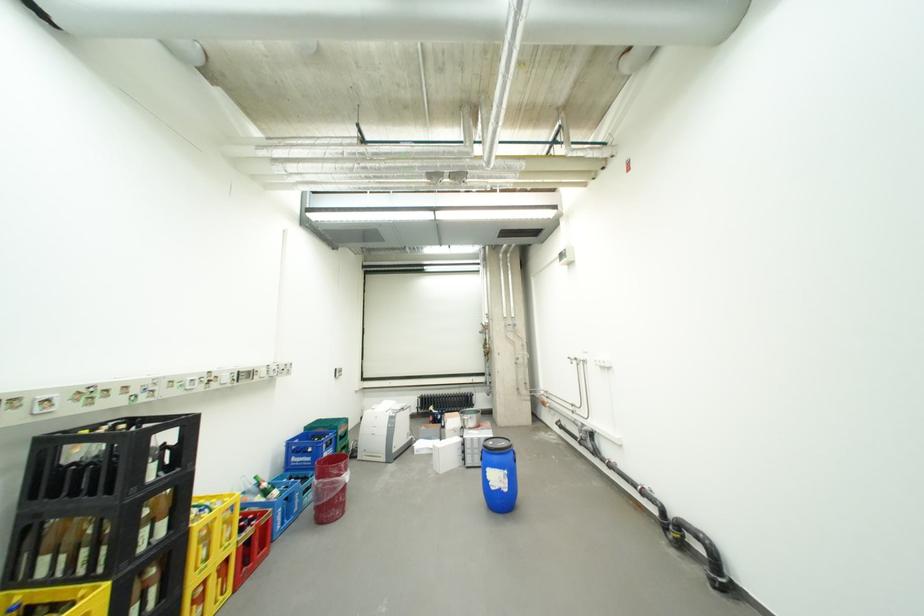
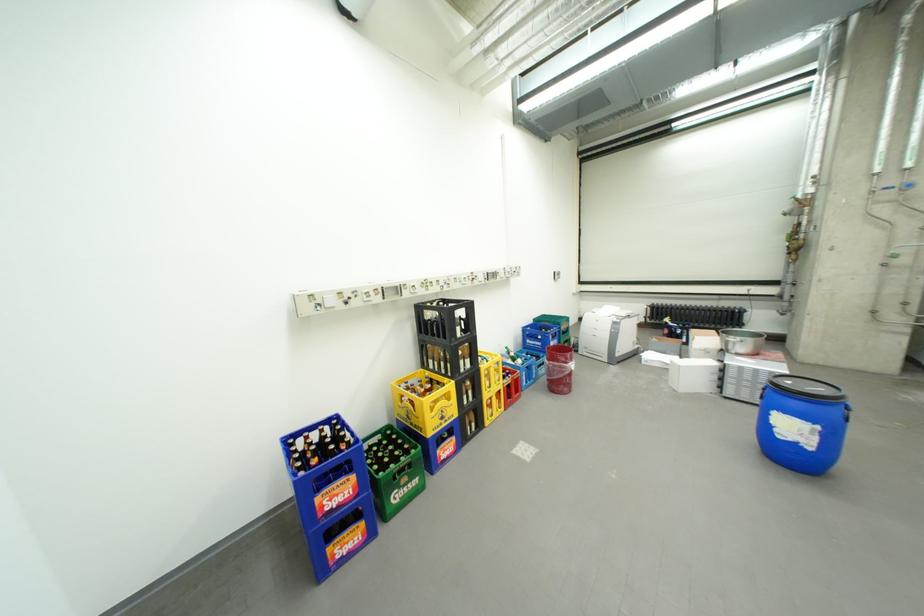
In the second image, find the point that corresponds to pixel 478 429 in the first image.

(744, 353)